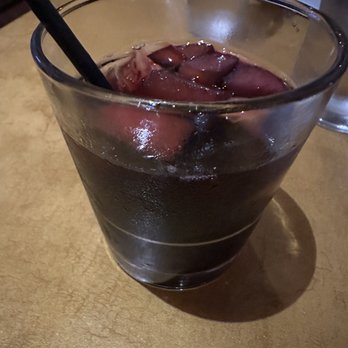
At what (x,y) coordinates should I click in order to perform the action: click on rim of glass. Please return your answer as a coordinate pair (x, y). Looking at the image, I should click on (167, 108).